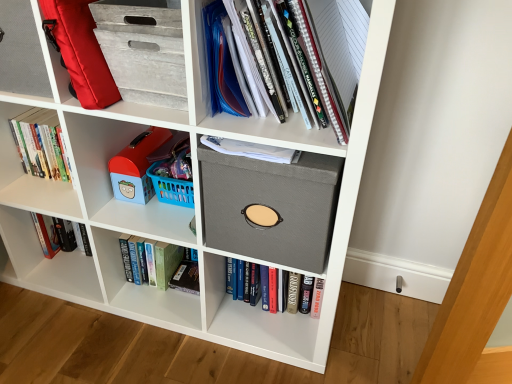
You are a GUI agent. You are given a task and a screenshot of the screen. Output one action in this format:
    pyautogui.click(x=<x>, y=<y>)
    Task: Click on the free point in front of hardcover book at lower left, which is the 2th book from bottom to top
    The width and height of the screenshot is (512, 384).
    Given the screenshot: What is the action you would take?
    pyautogui.click(x=138, y=334)